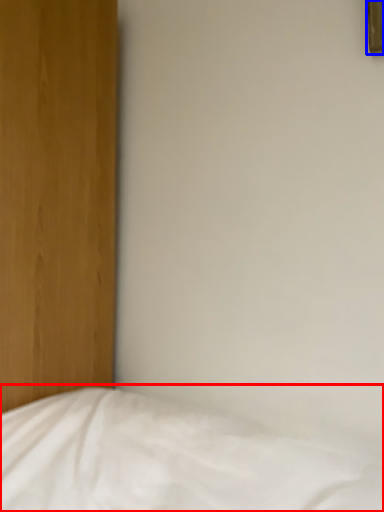
Question: Which object is further to the camera taking this photo, bed (highlighted by a red box) or picture frame (highlighted by a blue box)?

Choices:
 (A) bed
 (B) picture frame

Answer: (B)